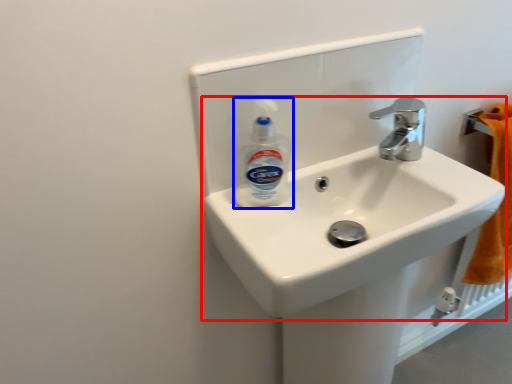
Question: Among these objects, which one is farthest to the camera, sink (highlighted by a red box) or cleaning product (highlighted by a blue box)?

Choices:
 (A) sink
 (B) cleaning product

Answer: (B)